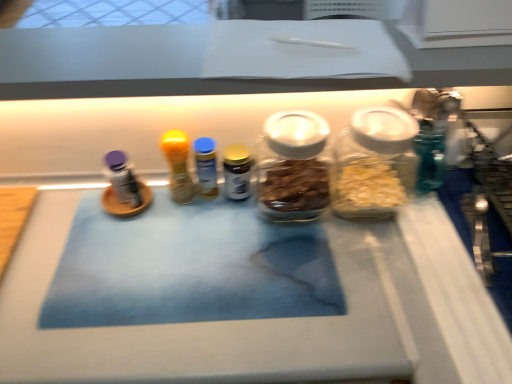
Question: Which direction should I rotate to look at yellow matte bottle at center, the fifth bottle positioned from the right?

Choices:
 (A) left
 (B) right

Answer: (A)

Question: Is gold metallic spice jar at center, the third bottle from the left, at the back of transparent glass jar at center, which appears as the 2th bottle when viewed from the right?

Choices:
 (A) yes
 (B) no

Answer: (B)

Question: Is transparent glass jar at center, which appears as the 2th bottle when viewed from the right, wider than gold metallic spice jar at center, the third bottle from the left?

Choices:
 (A) no
 (B) yes

Answer: (B)

Question: Considering the relative sizes of transparent glass jar at center, which appears as the 2th bottle when viewed from the right, and gold metallic spice jar at center, the third bottle from the left, in the image provided, is transparent glass jar at center, which appears as the 2th bottle when viewed from the right, taller than gold metallic spice jar at center, the third bottle from the left,?

Choices:
 (A) no
 (B) yes

Answer: (B)

Question: Would you say transparent glass jar at center, the 4th bottle when ordered from left to right, is outside gold metallic spice jar at center, the third bottle from the left?

Choices:
 (A) yes
 (B) no

Answer: (A)

Question: Is transparent glass jar at center, which appears as the 2th bottle when viewed from the right, further to the viewer compared to gold metallic spice jar at center, the third bottle from the left?

Choices:
 (A) no
 (B) yes

Answer: (A)

Question: Is transparent glass jar at center, the 4th bottle when ordered from left to right, next to gold metallic spice jar at center, the third bottle from the left, and touching it?

Choices:
 (A) yes
 (B) no

Answer: (A)

Question: From a real-world perspective, is blue plastic bottle at center, which is the fourth bottle from right to left, over gold metallic spice jar at center, the third bottle from the left?

Choices:
 (A) no
 (B) yes

Answer: (B)

Question: Is blue plastic bottle at center, which is the fourth bottle from right to left, facing towards gold metallic spice jar at center, the third bottle from the left?

Choices:
 (A) no
 (B) yes

Answer: (A)

Question: Can you confirm if blue plastic bottle at center, which is the fourth bottle from right to left, is positioned to the left of gold metallic spice jar at center, the third bottle from the left?

Choices:
 (A) no
 (B) yes

Answer: (B)

Question: Is blue plastic bottle at center, which is the fourth bottle from right to left, next to gold metallic spice jar at center, which is counted as the third bottle, starting from the right?

Choices:
 (A) no
 (B) yes

Answer: (B)

Question: Can you confirm if blue plastic bottle at center, the second bottle viewed from the left, is thinner than gold metallic spice jar at center, which is counted as the third bottle, starting from the right?

Choices:
 (A) no
 (B) yes

Answer: (A)

Question: From the image's perspective, is blue plastic bottle at center, which is the fourth bottle from right to left, below gold metallic spice jar at center, which is counted as the third bottle, starting from the right?

Choices:
 (A) no
 (B) yes

Answer: (A)

Question: Is blue plastic bottle at center, which is the fourth bottle from right to left, further to the viewer compared to yellow matte bottle at center, marked as the 1th bottle in a left-to-right arrangement?

Choices:
 (A) yes
 (B) no

Answer: (A)